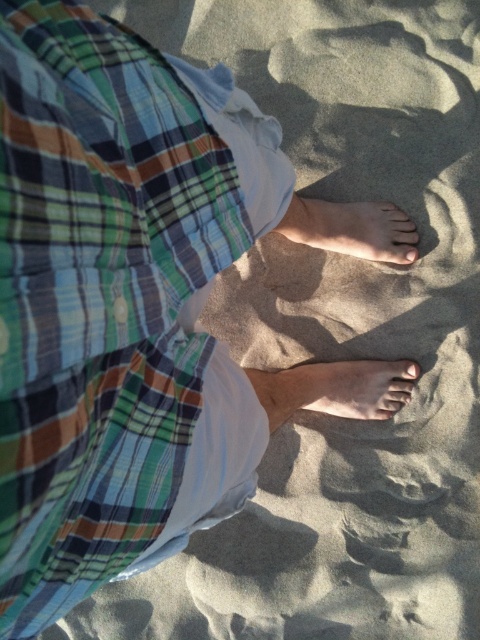
You are a photographer trying to capture the best angle of the two features on the person standing on the sand. The skinny white foot at center and the matte skin toe at center are both in your view. Which one should you focus on if you want to highlight the one that is covering part of the other?

You should focus on the skinny white foot at center because it is positioned over the matte skin toe at center, making it the one that is covering part of the other.

You are a photographer capturing a closeup of a person standing on a beach. You need to ensure that both the light brown skin at center and the matte skin toe at center are visible in the frame. Based on their positions, which object is closer to the camera?

The matte skin toe at center is closer to the camera because the light brown skin at center is located below it, indicating it is positioned further back.